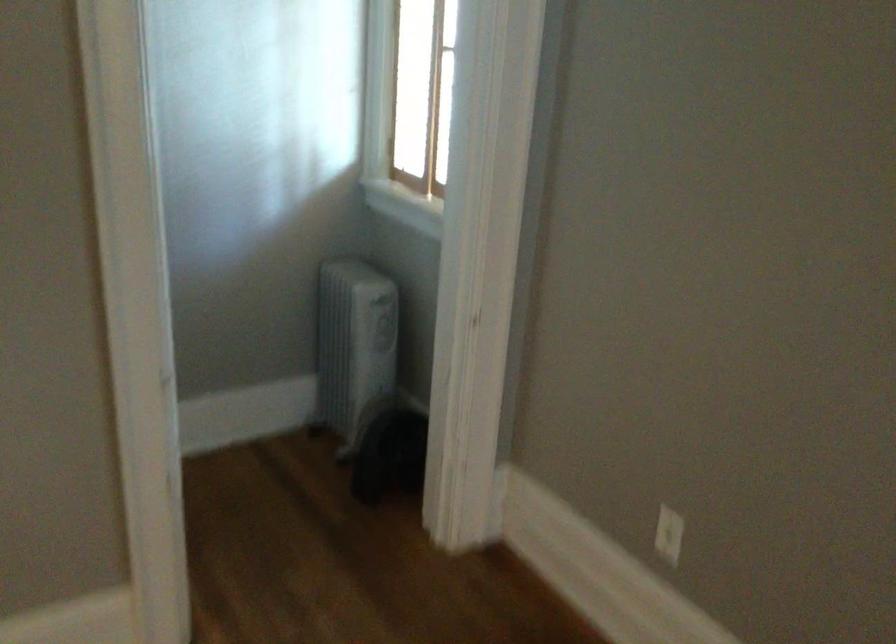
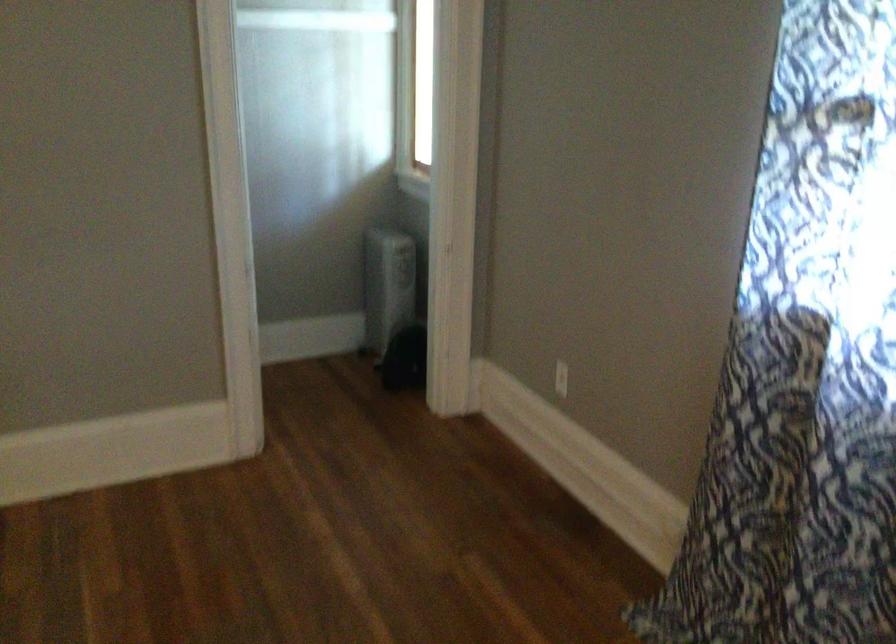
In the second image, find the point that corresponds to the point at 661,526 in the first image.

(561, 379)